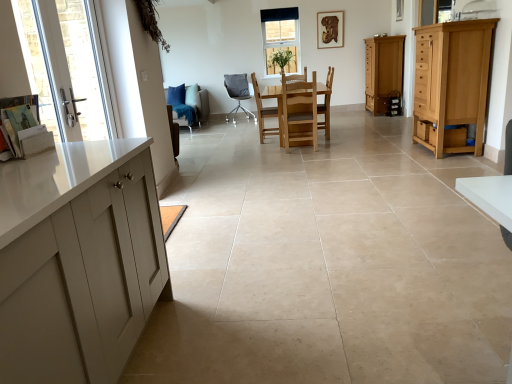
Question: Considering the positions of light brown wood cabinet at right, arranged as the 2th cabinetry when viewed from the back, and light brown wooden chair at center, placed as the 2th chair when sorted from right to left, in the image, is light brown wood cabinet at right, arranged as the 2th cabinetry when viewed from the back, taller or shorter than light brown wooden chair at center, placed as the 2th chair when sorted from right to left,?

Choices:
 (A) tall
 (B) short

Answer: (A)

Question: Looking at their shapes, would you say light brown wood cabinet at right, the 1th cabinetry when ordered from front to back, is wider or thinner than light brown wooden chair at center, placed as the 2th chair when sorted from right to left?

Choices:
 (A) thin
 (B) wide

Answer: (A)

Question: Based on their relative distances, which object is nearer to the wooden chair at center, the 1th chair from the right?

Choices:
 (A) wooden frame window at upper center
 (B) wooden picture frame at upper center
 (C) wooden drawer at lower right, placed as the second drawer when sorted from top to bottom
 (D) clear glass door at left
 (E) light brown wood cabinet at right, arranged as the 2th cabinetry when viewed from the back

Answer: (C)

Question: Estimate the real-world distances between objects in this image. Which object is closer to the light wood drawer at right, which is the 2th drawer from front to back?

Choices:
 (A) matte gray chair at center, positioned as the second chair in left-to-right order
 (B) light brown wood cabinet at right, the 1th cabinetry when ordered from front to back
 (C) clear glass door at left
 (D) wooden picture frame at upper center
 (E) matte wooden cabinet at right, the 1th cabinetry in the back-to-front sequence

Answer: (B)